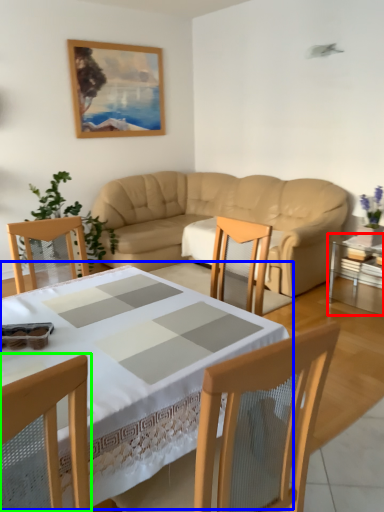
Question: Which object is positioned closest to table (highlighted by a red box)? Select from table (highlighted by a blue box) and chair (highlighted by a green box).

Choices:
 (A) table
 (B) chair

Answer: (A)